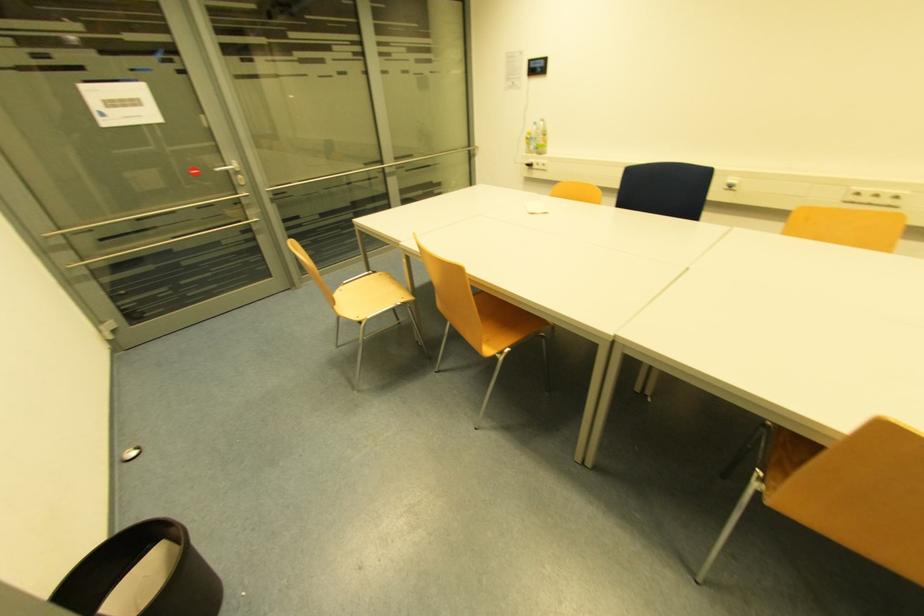
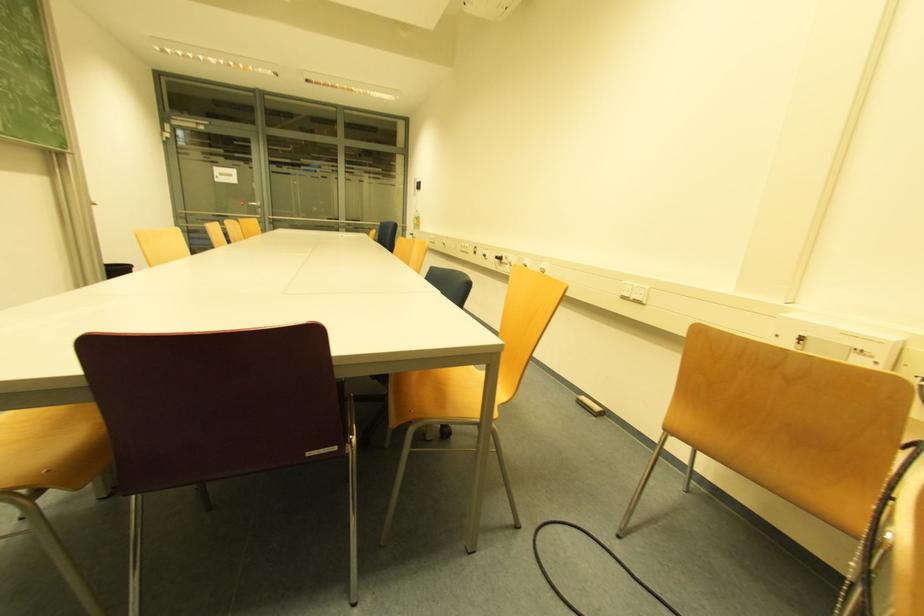
Question: What movement of the cameraman would produce the second image?

Choices:
 (A) Left
 (B) Right
 (C) Forward
 (D) Backward

Answer: (B)